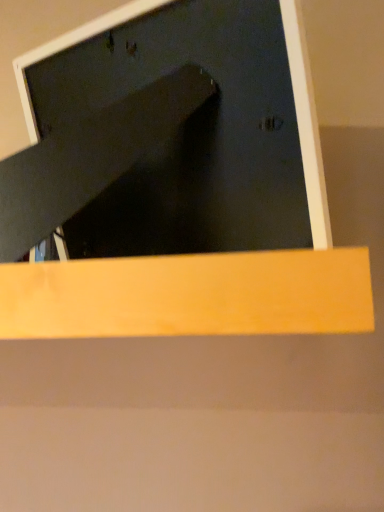
Question: Should I look upward or downward to see matte black monitor at upper center?

Choices:
 (A) down
 (B) up

Answer: (B)